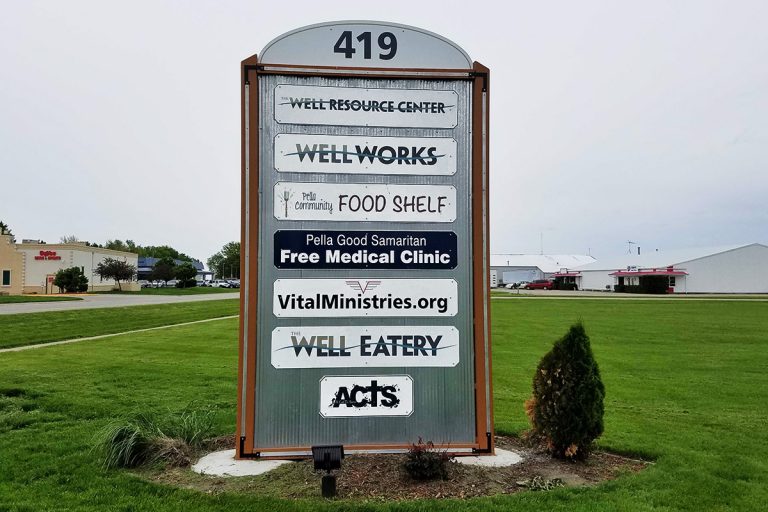
Identify the location of floor light. (332, 459).